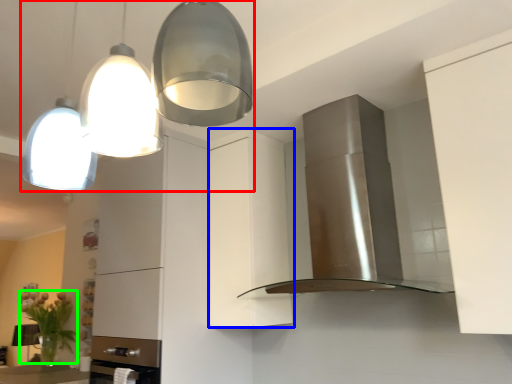
Question: Estimate the real-world distances between objects in this image. Which object is farther from light fixture (highlighted by a red box), cabinetry (highlighted by a blue box) or plant (highlighted by a green box)?

Choices:
 (A) cabinetry
 (B) plant

Answer: (B)